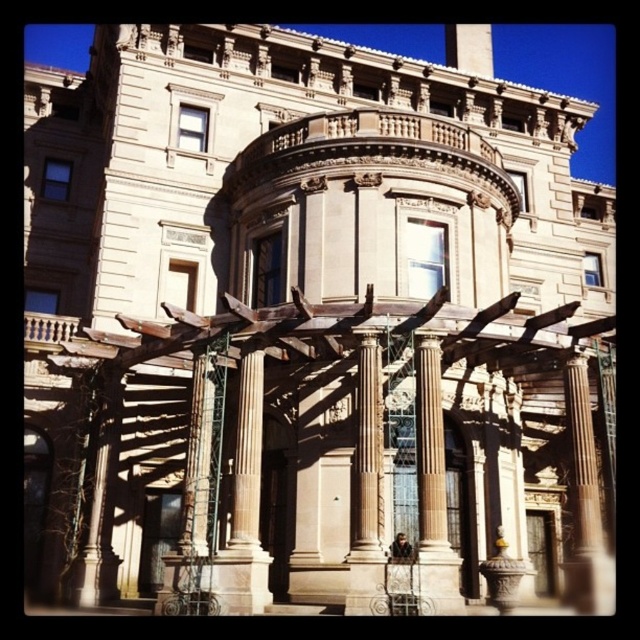
You are standing at the entrance of the grand classical building and want to know how far you are from the point marked at coordinates point (433, 481). Can you determine the distance?

Result: The point (433, 481) is 40.20 meters away from the viewer.